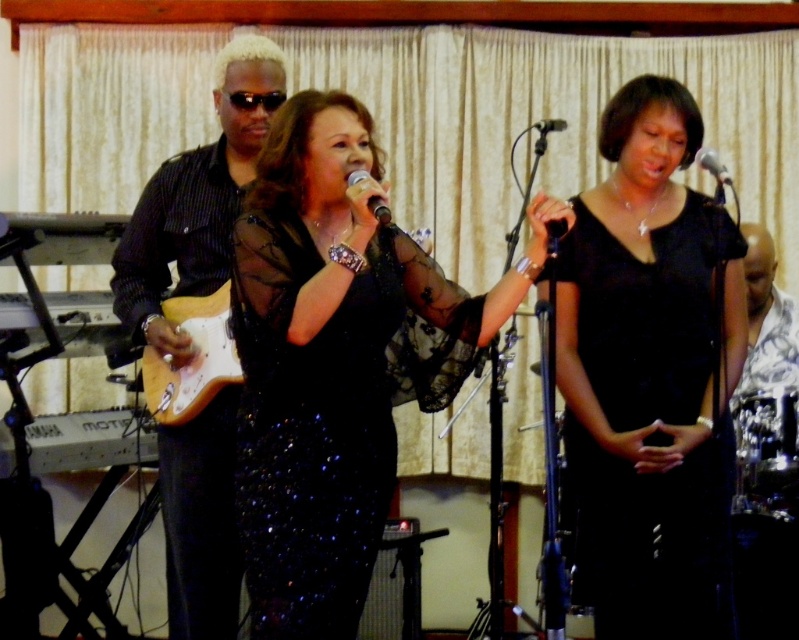
Does point (193, 348) come behind point (700, 156)?

Yes.

Is point (237, 369) farther from camera compared to point (702, 148)?

No.

This screenshot has height=640, width=799. I want to click on light wood electric guitar at center, so click(x=191, y=358).

Between sparkly black dress at center and black matte microphone at upper center, which one is positioned lower?

sparkly black dress at center is below.

Where is `sparkly black dress at center`? sparkly black dress at center is located at coordinates (332, 360).

Who is more forward, (x=305, y=330) or (x=545, y=120)?

Point (x=305, y=330)

Identify the location of sparkly black dress at center. Image resolution: width=799 pixels, height=640 pixels. (332, 360).

Does black satin dress at center lie in front of black metallic microphone at center?

No.

Is black satin dress at center wider than black metallic microphone at center?

Correct, the width of black satin dress at center exceeds that of black metallic microphone at center.

Where is `black satin dress at center`? The height and width of the screenshot is (640, 799). black satin dress at center is located at coordinates (650, 376).